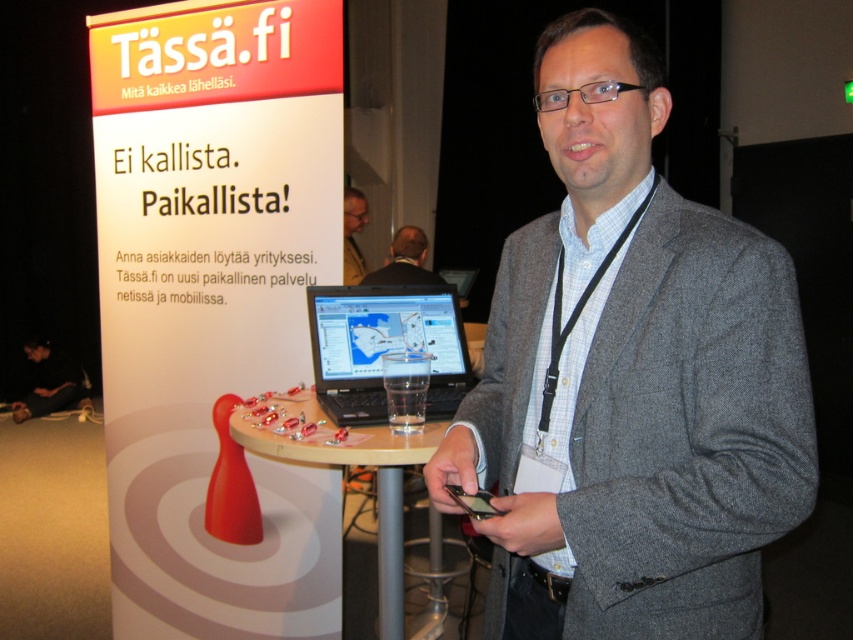
Between black plastic laptop at center and dark gray suit at center, which one appears on the right side from the viewer's perspective?

black plastic laptop at center

Is black plastic laptop at center positioned behind dark gray suit at center?

No, black plastic laptop at center is in front of dark gray suit at center.

The height and width of the screenshot is (640, 853). Find the location of `black plastic laptop at center`. black plastic laptop at center is located at coordinates (384, 346).

Does black leather jacket at lower left have a smaller size compared to glossy black laptop at center?

No, black leather jacket at lower left is not smaller than glossy black laptop at center.

Between black leather jacket at lower left and glossy black laptop at center, which one appears on the left side from the viewer's perspective?

black leather jacket at lower left is more to the left.

What do you see at coordinates (50, 381) in the screenshot? The image size is (853, 640). I see `black leather jacket at lower left` at bounding box center [50, 381].

The image size is (853, 640). Identify the location of black leather jacket at lower left. (50, 381).

Which is more to the left, smooth wooden table at center or black leather jacket at lower left?

Positioned to the left is black leather jacket at lower left.

Is smooth wooden table at center to the left of black leather jacket at lower left from the viewer's perspective?

In fact, smooth wooden table at center is to the right of black leather jacket at lower left.

Which is behind, point (438, 438) or point (38, 381)?

Point (38, 381)

Find the location of a particular element. This screenshot has width=853, height=640. smooth wooden table at center is located at coordinates (376, 497).